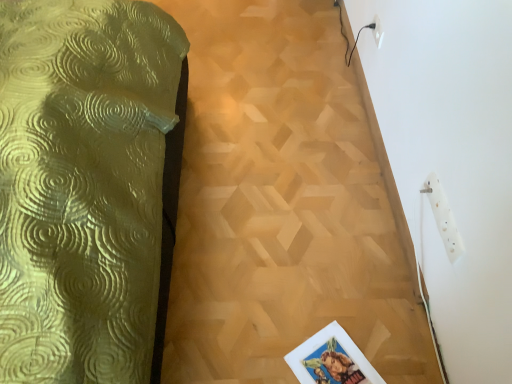
Find the location of a particular element. This screenshot has width=512, height=384. empty space that is ontop of wooden parquet floor at center (from a real-world perspective) is located at coordinates (230, 133).